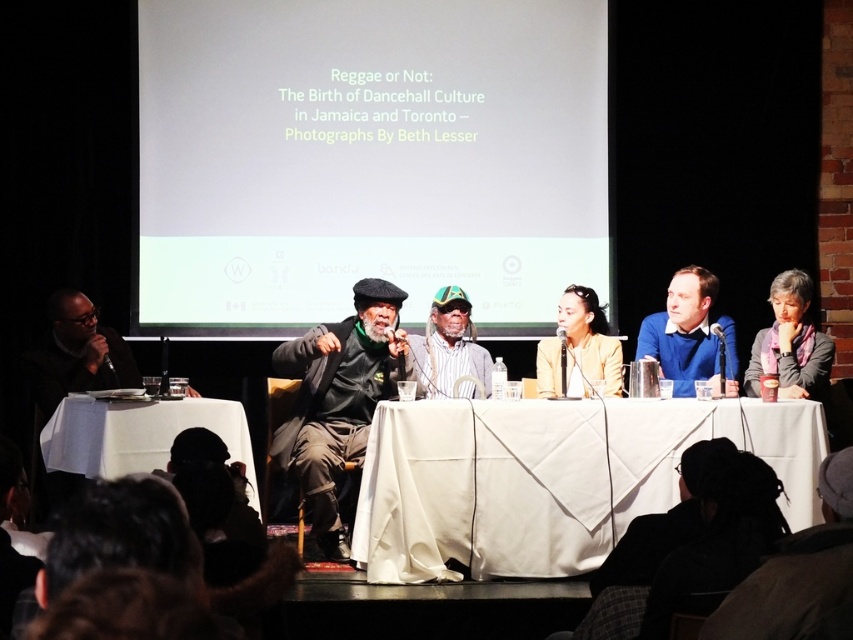
Question: Which object appears closest to the camera in this image?

Choices:
 (A) striped fabric hat at center
 (B) white cloth-covered table at lower left
 (C) blue sweater at center
 (D) white cloth-covered table at center

Answer: (B)

Question: Which point is closer to the camera?

Choices:
 (A) (769, 408)
 (B) (666, 298)
 (C) (447, 332)
 (D) (332, 349)

Answer: (A)

Question: Does white matte screen at upper center appear on the right side of matte yellow blazer at center?

Choices:
 (A) yes
 (B) no

Answer: (B)

Question: Is the position of matte black jacket at center less distant than that of striped fabric hat at center?

Choices:
 (A) yes
 (B) no

Answer: (A)

Question: Based on their relative distances, which object is farther from the matte black suit at left?

Choices:
 (A) blue sweater at center
 (B) white cloth-covered table at center

Answer: (A)

Question: Can you confirm if white cloth-covered table at center is positioned to the right of blue sweater at center?

Choices:
 (A) no
 (B) yes

Answer: (A)